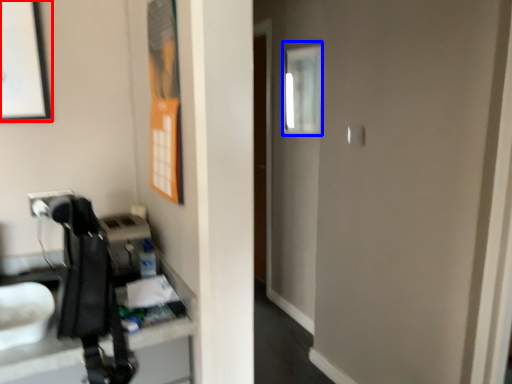
Question: Which point is closer to the camera, picture frame (highlighted by a red box) or mirror (highlighted by a blue box)?

Choices:
 (A) picture frame
 (B) mirror

Answer: (A)